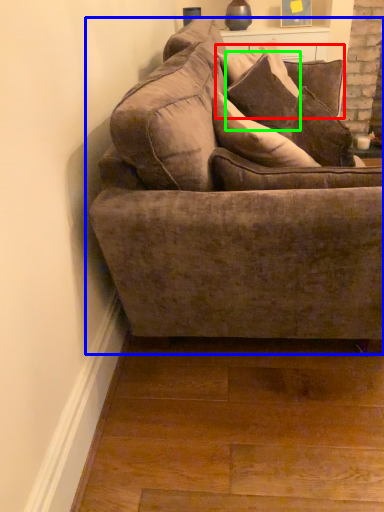
Question: Which object is the closest to the pillow (highlighted by a red box)? Choose among these: studio couch (highlighted by a blue box) or pillow (highlighted by a green box).

Choices:
 (A) studio couch
 (B) pillow

Answer: (B)